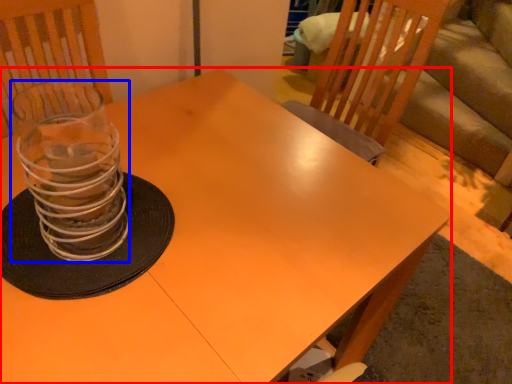
Question: Which object is closer to the camera taking this photo, table (highlighted by a red box) or candle holder (highlighted by a blue box)?

Choices:
 (A) table
 (B) candle holder

Answer: (A)